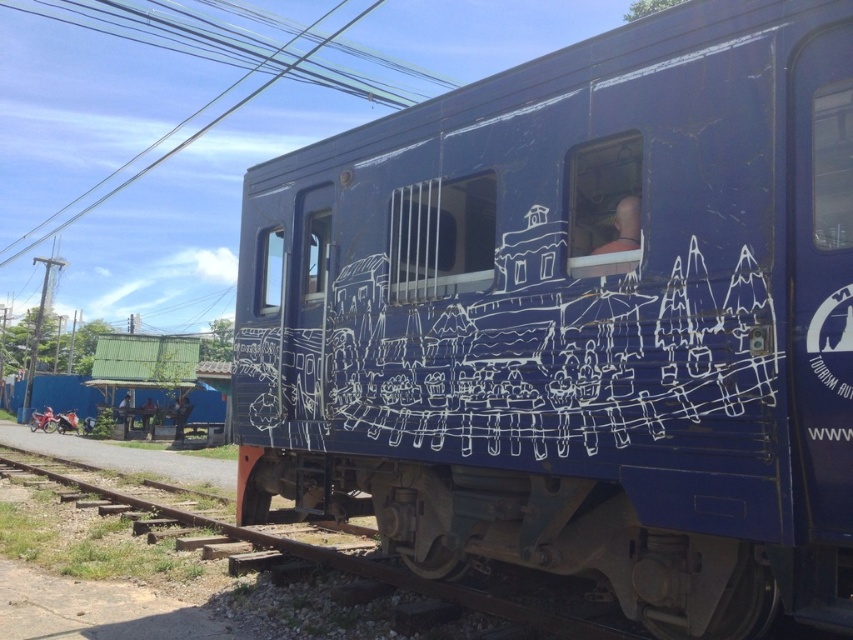
You are an artist planning to add a new element to the blue matte train at center and the white chalk drawing at center. Considering their widths, which object would allow you to add more details without overcrowding?

The white chalk drawing at center has a greater width than the blue matte train at center, so it can accommodate more details without overcrowding.

You are a painter standing 2 meters away from the blue matte train at center. You want to paint the white chalk drawing at center without moving closer. Can you reach it with a 1.2 meter long paintbrush?

The blue matte train at center is 1.22 meters from the white chalk drawing at center. Since the paintbrush is only 1.2 meters long, it is 2 centimeters shorter than needed. Therefore, you cannot reach the white chalk drawing at center with the current setup.